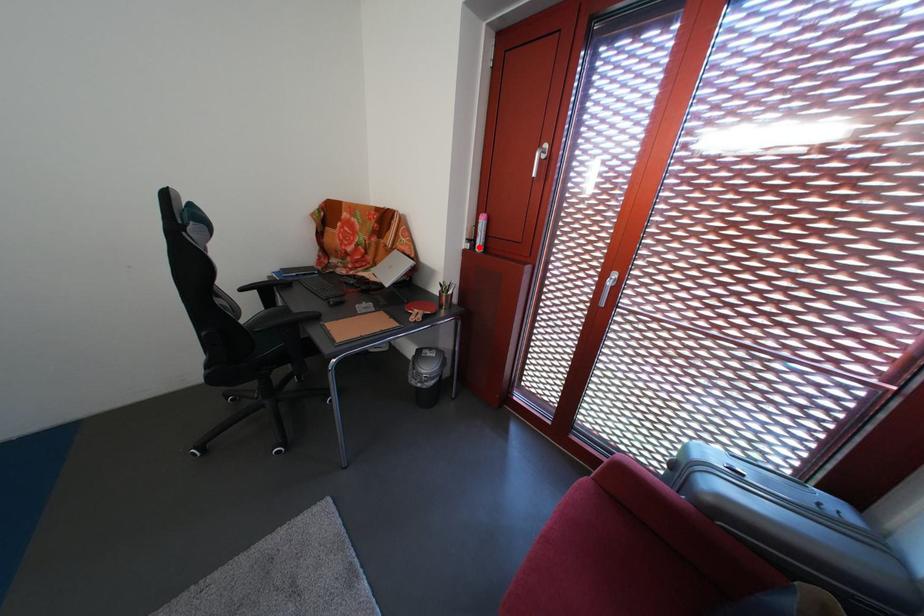
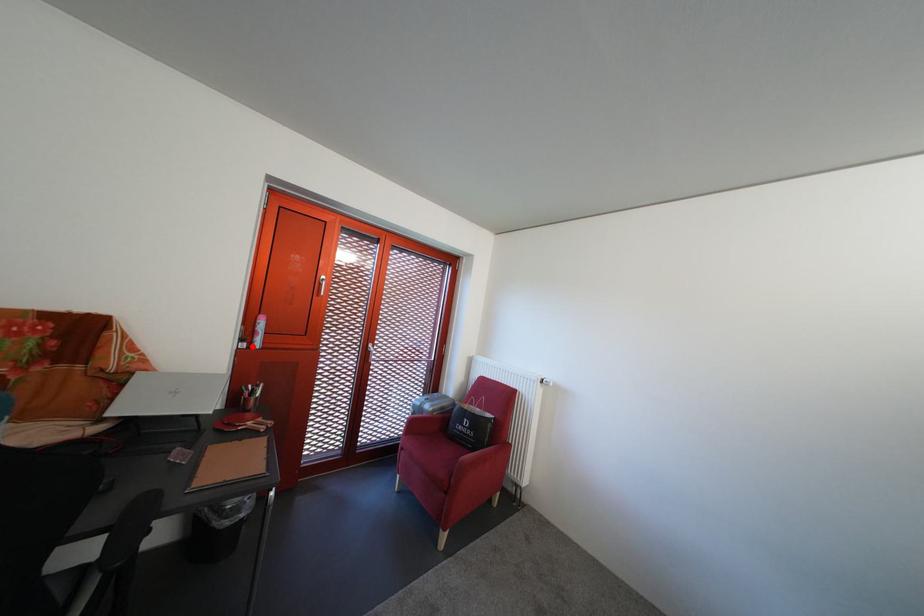
I am providing you with two images of the same scene from different viewpoints. A red point is marked on the first image and another point is marked on the second image. Is the marked point in image1 the same physical position as the marked point in image2?

Yes